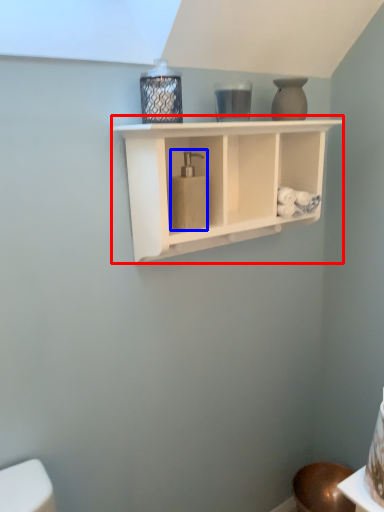
Question: Which point is closer to the camera, shelf (highlighted by a red box) or soap dispenser (highlighted by a blue box)?

Choices:
 (A) shelf
 (B) soap dispenser

Answer: (A)